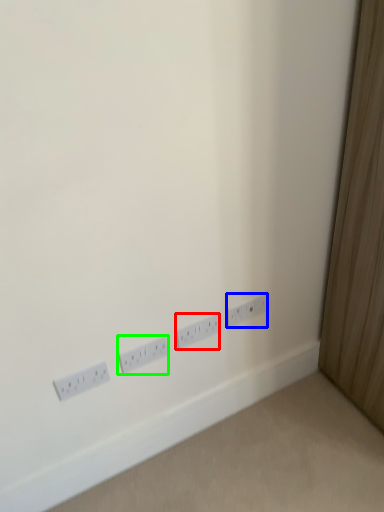
Question: Based on their relative distances, which object is nearer to power plugs and sockets (highlighted by a red box)? Choose from power plugs and sockets (highlighted by a blue box) and power plugs and sockets (highlighted by a green box).

Choices:
 (A) power plugs and sockets
 (B) power plugs and sockets

Answer: (A)